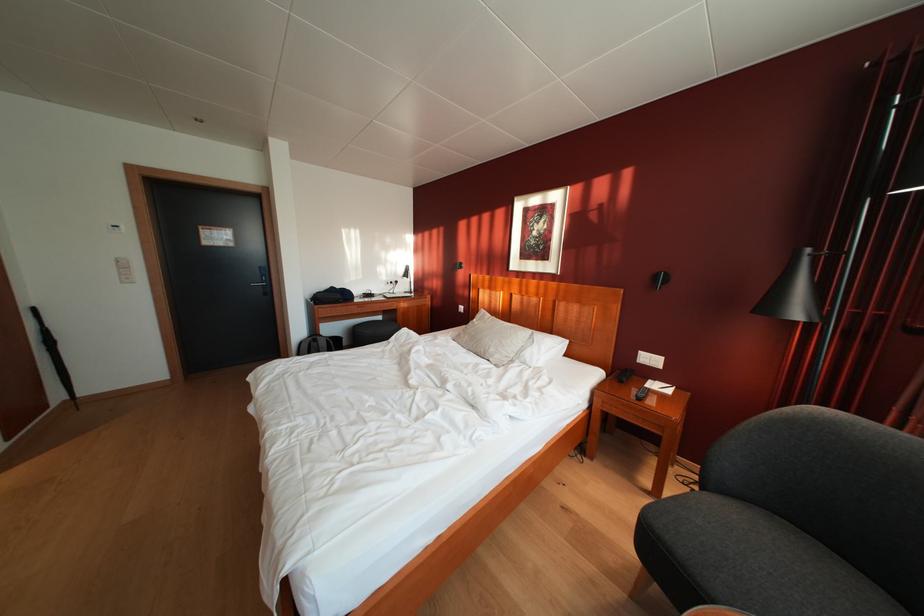
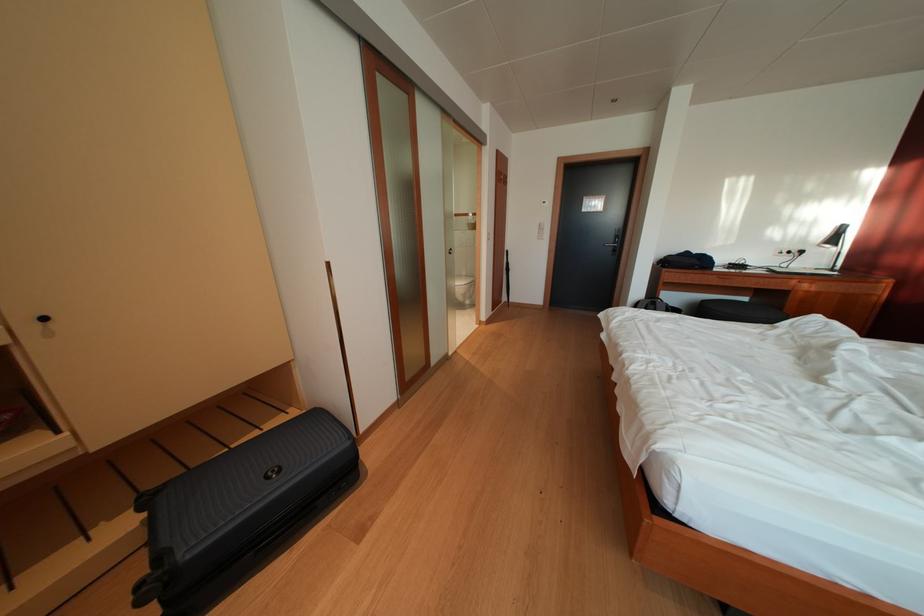
The point at (405, 288) is marked in the first image. Where is the corresponding point in the second image?

(809, 257)